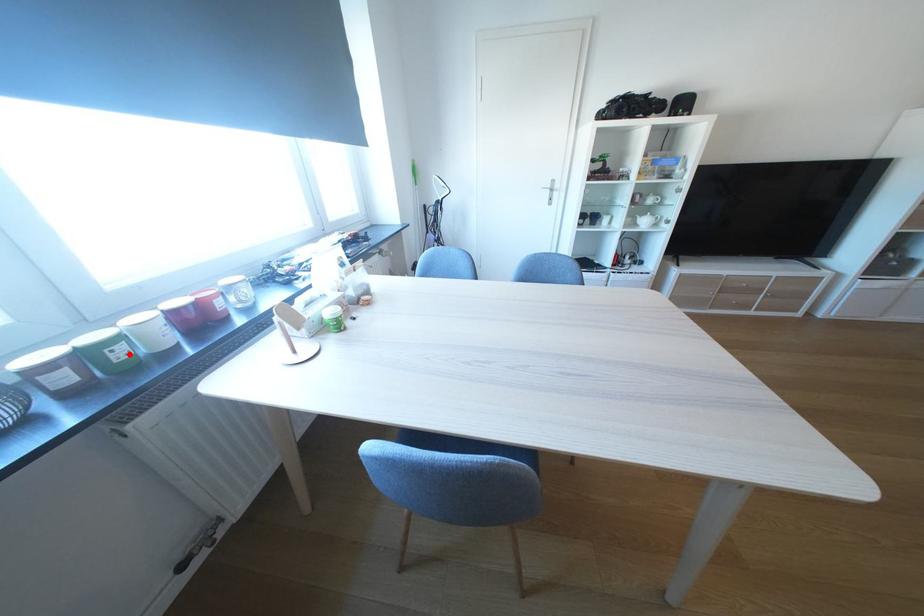
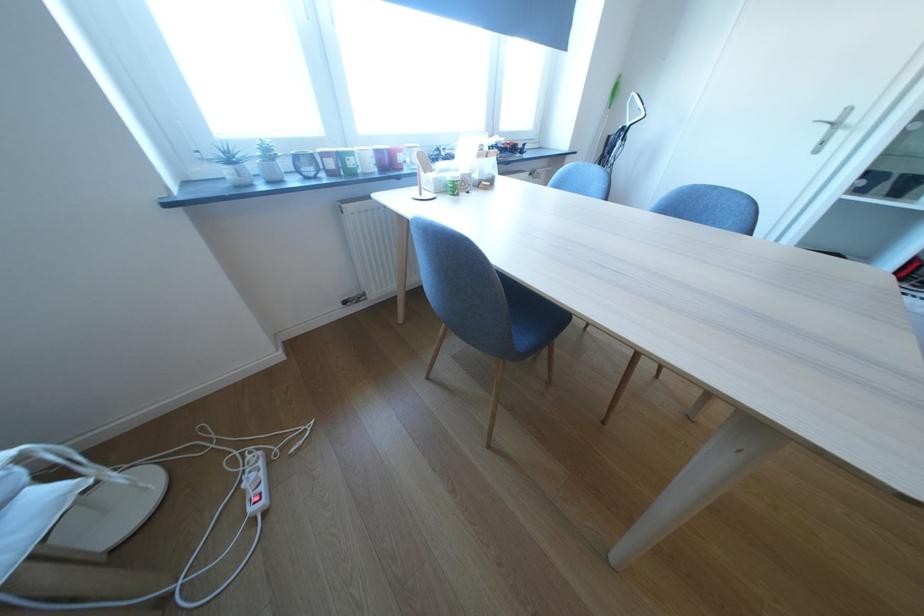
Question: I am providing you with two images of the same scene from different viewpoints. A red point is shown in image1. For the corresponding object point in image2, is it positioned nearer or farther from the camera?

Choices:
 (A) Nearer
 (B) Farther

Answer: (A)